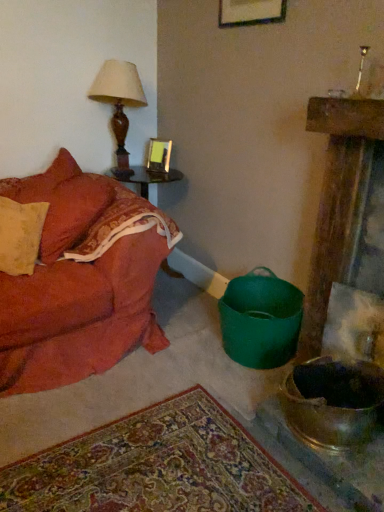
The height and width of the screenshot is (512, 384). In order to click on shiny metallic mixing bowl at lower right in this screenshot , I will do `click(332, 403)`.

What do you see at coordinates (146, 180) in the screenshot? The image size is (384, 512). I see `wooden round table at left` at bounding box center [146, 180].

I want to click on velvet orange couch at left, so click(x=81, y=280).

Which is behind, point (380, 382) or point (104, 76)?

Point (104, 76)

Can you confirm if shiny metallic mixing bowl at lower right is thinner than matte brown table lamp at upper left?

Incorrect, the width of shiny metallic mixing bowl at lower right is not less than that of matte brown table lamp at upper left.

This screenshot has width=384, height=512. In order to click on table lamp behind the shiny metallic mixing bowl at lower right in this screenshot , I will do `click(119, 103)`.

Between shiny metallic mixing bowl at lower right and matte brown table lamp at upper left, which one has less height?

Standing shorter between the two is shiny metallic mixing bowl at lower right.

Which is nearer, (327, 383) or (61, 374)?

Positioned in front is point (327, 383).

Between shiny metallic mixing bowl at lower right and velvet orange couch at left, which one has less height?

With less height is shiny metallic mixing bowl at lower right.

Can you tell me how much shiny metallic mixing bowl at lower right and velvet orange couch at left differ in facing direction?

shiny metallic mixing bowl at lower right and velvet orange couch at left are facing 88.8 degrees away from each other.

In the image, is shiny metallic mixing bowl at lower right on the left side or the right side of velvet orange couch at left?

shiny metallic mixing bowl at lower right is to the right of velvet orange couch at left.

Between matte glass picture frame at upper center and matte brown table lamp at upper left, which one has smaller size?

With smaller size is matte glass picture frame at upper center.

Is matte glass picture frame at upper center directly adjacent to matte brown table lamp at upper left?

No.

From the image's perspective, is matte glass picture frame at upper center below matte brown table lamp at upper left?

Indeed, from the image's perspective, matte glass picture frame at upper center is shown beneath matte brown table lamp at upper left.

Is matte glass picture frame at upper center looking in the opposite direction of matte brown table lamp at upper left?

No.

Would you say velvet orange couch at left is a long distance from matte brown table lamp at upper left?

That's not correct — velvet orange couch at left is a little close to matte brown table lamp at upper left.

Who is more distant, velvet orange couch at left or matte brown table lamp at upper left?

matte brown table lamp at upper left is further from the camera.

Does velvet orange couch at left have a lesser height compared to matte brown table lamp at upper left?

In fact, velvet orange couch at left may be taller than matte brown table lamp at upper left.

Is velvet orange couch at left not within matte brown table lamp at upper left?

Indeed, velvet orange couch at left is completely outside matte brown table lamp at upper left.

Does matte brown table lamp at upper left have a greater width compared to velvet orange couch at left?

Incorrect, the width of matte brown table lamp at upper left does not surpass that of velvet orange couch at left.

The height and width of the screenshot is (512, 384). There is a velvet orange couch at left. In order to click on table lamp above it (from a real-world perspective) in this screenshot , I will do `click(119, 103)`.

Looking at this image, from a real-world perspective, is matte brown table lamp at upper left positioned over velvet orange couch at left based on gravity?

Yes.

Which of these two, matte brown table lamp at upper left or velvet orange couch at left, stands taller?

velvet orange couch at left.

Which is in front, shiny metallic mixing bowl at lower right or matte glass picture frame at upper center?

shiny metallic mixing bowl at lower right is closer to the camera.

From the image's perspective, is shiny metallic mixing bowl at lower right located above or below matte glass picture frame at upper center?

Based on their image positions, shiny metallic mixing bowl at lower right is located beneath matte glass picture frame at upper center.

How much distance is there between shiny metallic mixing bowl at lower right and matte glass picture frame at upper center?

A distance of 1.66 meters exists between shiny metallic mixing bowl at lower right and matte glass picture frame at upper center.

Is shiny metallic mixing bowl at lower right oriented away from matte glass picture frame at upper center?

No, matte glass picture frame at upper center is not at the back of shiny metallic mixing bowl at lower right.

Identify the location of table that appears below the matte brown table lamp at upper left (from the image's perspective). This screenshot has width=384, height=512. (146, 180).

How many degrees apart are the facing directions of matte brown table lamp at upper left and wooden round table at left?

The facing directions of matte brown table lamp at upper left and wooden round table at left are 0.000165 degrees apart.

Which is closer to the camera, [101,91] or [148,197]?

Point [101,91]

Is matte brown table lamp at upper left situated inside wooden round table at left or outside?

matte brown table lamp at upper left is not enclosed by wooden round table at left.

At what (x,y) coordinates should I click in order to perform the action: click on table lamp above the shiny metallic mixing bowl at lower right (from the image's perspective). Please return your answer as a coordinate pair (x, y). Image resolution: width=384 pixels, height=512 pixels. Looking at the image, I should click on (119, 103).

The image size is (384, 512). I want to click on mixing bowl below the velvet orange couch at left (from a real-world perspective), so click(332, 403).

Considering their positions, is matte brown table lamp at upper left positioned closer to velvet orange couch at left than wooden round table at left?

matte brown table lamp at upper left lies closer to velvet orange couch at left than the other object.

When comparing their distances from matte glass picture frame at upper center, does shiny metallic mixing bowl at lower right or matte brown table lamp at upper left seem closer?

matte brown table lamp at upper left is closer to matte glass picture frame at upper center.

Looking at the image, which one is located further to velvet orange couch at left, shiny metallic mixing bowl at lower right or wooden round table at left?

shiny metallic mixing bowl at lower right lies further to velvet orange couch at left than the other object.

From the image, which object appears to be nearer to matte glass picture frame at upper center, matte brown table lamp at upper left or velvet orange couch at left?

matte brown table lamp at upper left lies closer to matte glass picture frame at upper center than the other object.

When comparing their distances from shiny metallic mixing bowl at lower right, does matte brown table lamp at upper left or matte glass picture frame at upper center seem closer?

Among the two, matte glass picture frame at upper center is located nearer to shiny metallic mixing bowl at lower right.

Which object lies nearer to the anchor point matte brown table lamp at upper left, velvet orange couch at left or matte glass picture frame at upper center?

matte glass picture frame at upper center lies closer to matte brown table lamp at upper left than the other object.

Considering their positions, is matte brown table lamp at upper left positioned closer to wooden round table at left than velvet orange couch at left?

Among the two, matte brown table lamp at upper left is located nearer to wooden round table at left.

Based on their spatial positions, is shiny metallic mixing bowl at lower right or wooden round table at left further from matte brown table lamp at upper left?

shiny metallic mixing bowl at lower right is positioned further to the anchor matte brown table lamp at upper left.

You are a GUI agent. You are given a task and a screenshot of the screen. Output one action in this format:
    pyautogui.click(x=<x>, y=<y>)
    Task: Click on the table between shiny metallic mixing bowl at lower right and matte glass picture frame at upper center along the z-axis
    The width and height of the screenshot is (384, 512).
    Given the screenshot: What is the action you would take?
    pyautogui.click(x=146, y=180)

This screenshot has height=512, width=384. I want to click on table between matte brown table lamp at upper left and shiny metallic mixing bowl at lower right in the vertical direction, so click(x=146, y=180).

Find the location of a particular element. This screenshot has width=384, height=512. picture frame between matte brown table lamp at upper left and shiny metallic mixing bowl at lower right vertically is located at coordinates (159, 155).

The image size is (384, 512). What are the coordinates of `picture frame between matte brown table lamp at upper left and wooden round table at left in the up-down direction` in the screenshot? It's located at (159, 155).